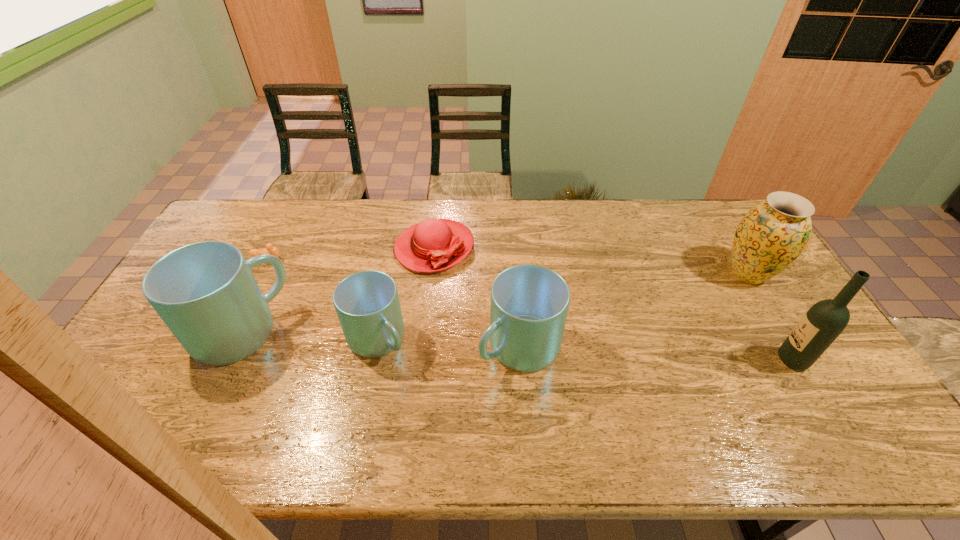
You are a GUI agent. You are given a task and a screenshot of the screen. Output one action in this format:
    pyautogui.click(x=<x>, y=<y>)
    Task: Click on the free space that satisfies the following two spatial constraints: 1. on the back side of the leftmost mug; 2. on the face of the duckling
    This screenshot has width=960, height=540.
    Given the screenshot: What is the action you would take?
    pyautogui.click(x=276, y=260)

Identify the location of free space that satisfies the following two spatial constraints: 1. on the back side of the shortest mug; 2. on the face of the shortest object. This screenshot has height=540, width=960. (395, 260).

The height and width of the screenshot is (540, 960). I want to click on free spot that satisfies the following two spatial constraints: 1. on the back side of the fifth tallest object; 2. on the face of the duckling, so click(x=395, y=260).